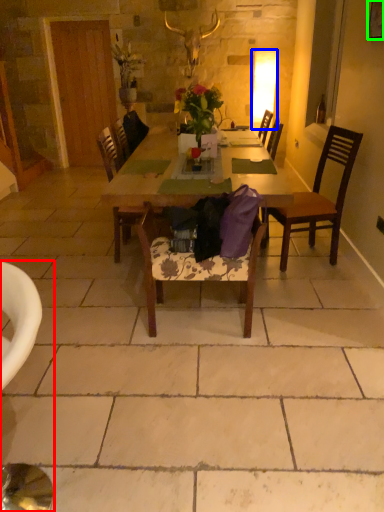
Question: Which is farther away from chair (highlighted by a red box)? lamp (highlighted by a blue box) or picture frame (highlighted by a green box)?

Choices:
 (A) lamp
 (B) picture frame

Answer: (A)